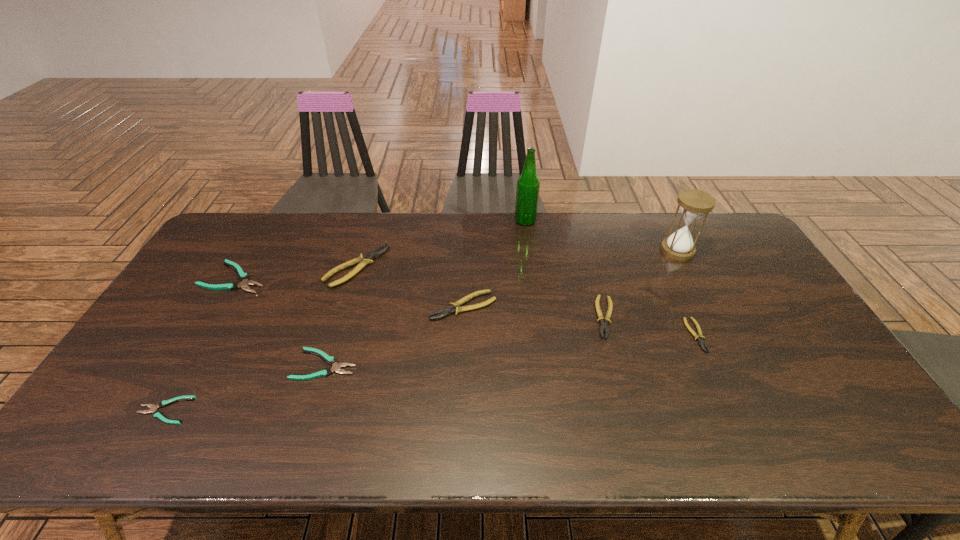
Image resolution: width=960 pixels, height=540 pixels. In order to click on blank space located on the front of the second tallest object in this screenshot , I will do `click(704, 302)`.

Where is `vacant space located 0.070m on the front of the tallest pliers`? Image resolution: width=960 pixels, height=540 pixels. vacant space located 0.070m on the front of the tallest pliers is located at coordinates (345, 306).

Locate an element on the screen. The height and width of the screenshot is (540, 960). blank space located 0.250m on the front of the fifth object from left to right is located at coordinates (460, 398).

Identify the location of vacant area situated on the back of the biggest teal pliers. (268, 222).

At what (x,y) coordinates should I click in order to perform the action: click on vacant space located on the right of the second smallest yellow pliers. Please return your answer as a coordinate pair (x, y). The height and width of the screenshot is (540, 960). Looking at the image, I should click on (739, 317).

Locate an element on the screen. The width and height of the screenshot is (960, 540). vacant area located 0.400m on the left of the rightmost teal pliers is located at coordinates (142, 364).

Find the location of a particular element. free region located 0.190m on the back of the smallest yellow pliers is located at coordinates click(x=668, y=274).

Image resolution: width=960 pixels, height=540 pixels. In order to click on free space located 0.380m on the back of the shortest pliers in this screenshot , I will do (x=234, y=289).

The image size is (960, 540). I want to click on beer bottle present at the far edge, so click(x=528, y=184).

Locate an element on the screen. The height and width of the screenshot is (540, 960). hourglass that is at the far edge is located at coordinates (694, 204).